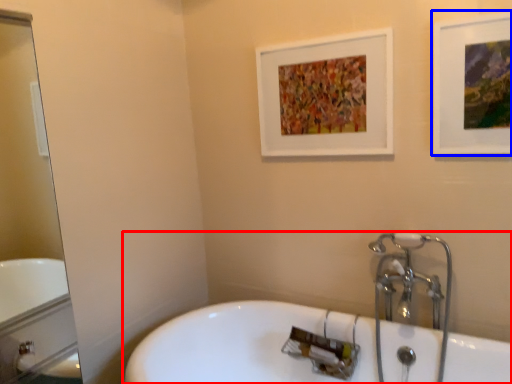
Question: Which of the following is the closest to the observer, bathtub (highlighted by a red box) or picture frame (highlighted by a blue box)?

Choices:
 (A) bathtub
 (B) picture frame

Answer: (A)